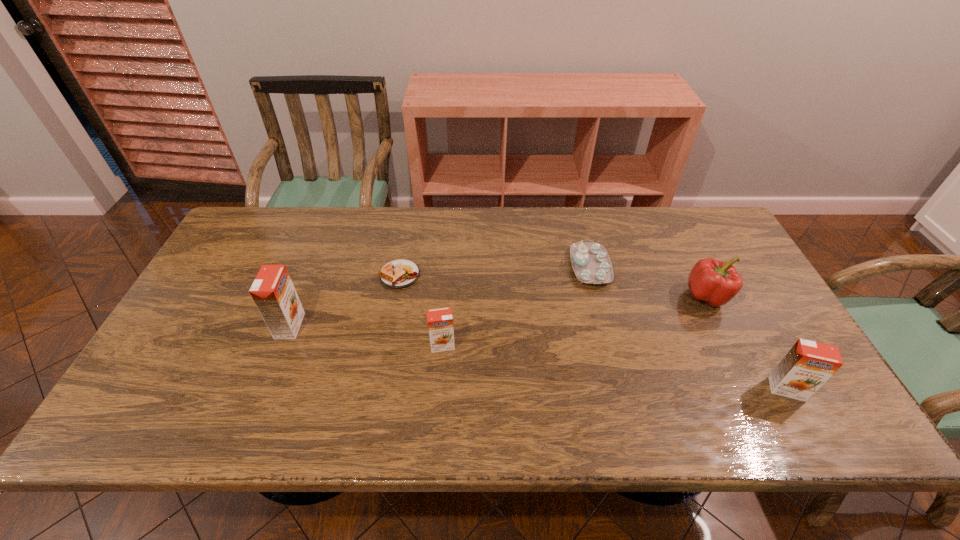
To make them evenly spaced by inserting another orange_juice among them, please locate a vacant spot for this new orange_juice. Please provide its 2D coordinates. Your answer should be formatted as a tuple, i.e. [(x, y)], where the tuple contains the x and y coordinates of a point satisfying the conditions above.

[(608, 366)]